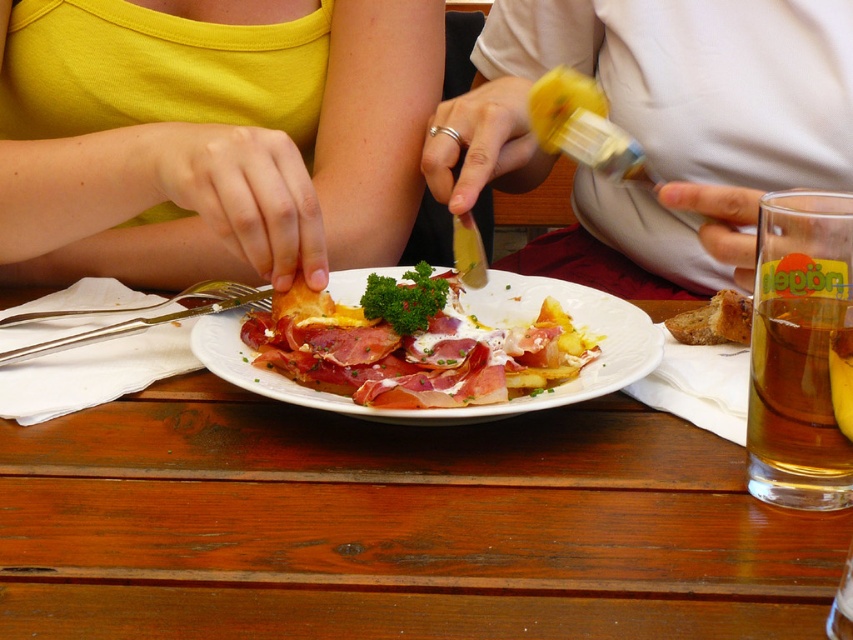
Is yellow matte tank top at upper left positioned behind brown crumbly bread at center?

No, it is not.

This screenshot has width=853, height=640. What do you see at coordinates (212, 136) in the screenshot? I see `yellow matte tank top at upper left` at bounding box center [212, 136].

The image size is (853, 640). I want to click on yellow matte tank top at upper left, so click(x=212, y=136).

Is the position of wooden table at center more distant than that of white matte shirt at center?

No, it is in front of white matte shirt at center.

Based on the photo, can you confirm if wooden table at center is positioned above white matte shirt at center?

No, wooden table at center is not above white matte shirt at center.

Who is more distant from viewer, (650,604) or (585,17)?

Point (585,17)

This screenshot has height=640, width=853. Find the location of `wooden table at center`. wooden table at center is located at coordinates 393,525.

Is wooden table at center below yellow matte tank top at upper left?

Indeed, wooden table at center is positioned under yellow matte tank top at upper left.

Who is more forward, (213, 515) or (49, 168)?

Point (213, 515) is in front.

Locate an element on the screen. wooden table at center is located at coordinates (393, 525).